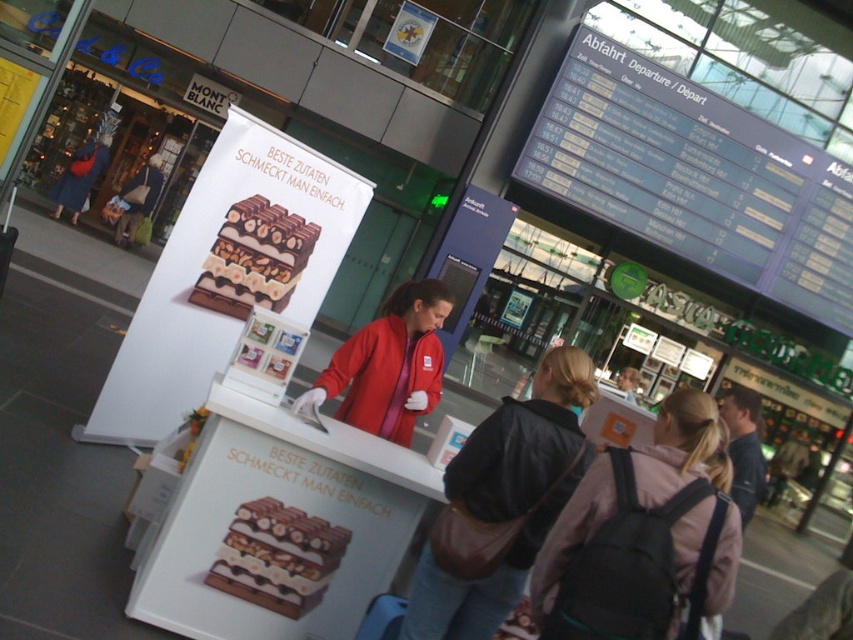
You are standing at the train station and want to take a photo of the departure board labeled Abfahrt. You notice two points marked on your map as point 1 at coordinates point (x=445, y=589) and point 2 at coordinates point (x=241, y=525). Which point is better to stand at to get a clear view of the departure board?

Point (x=445, y=589) is closer to the viewer than point (x=241, y=525), so standing at point (x=445, y=589) would provide a clearer view of the departure board.